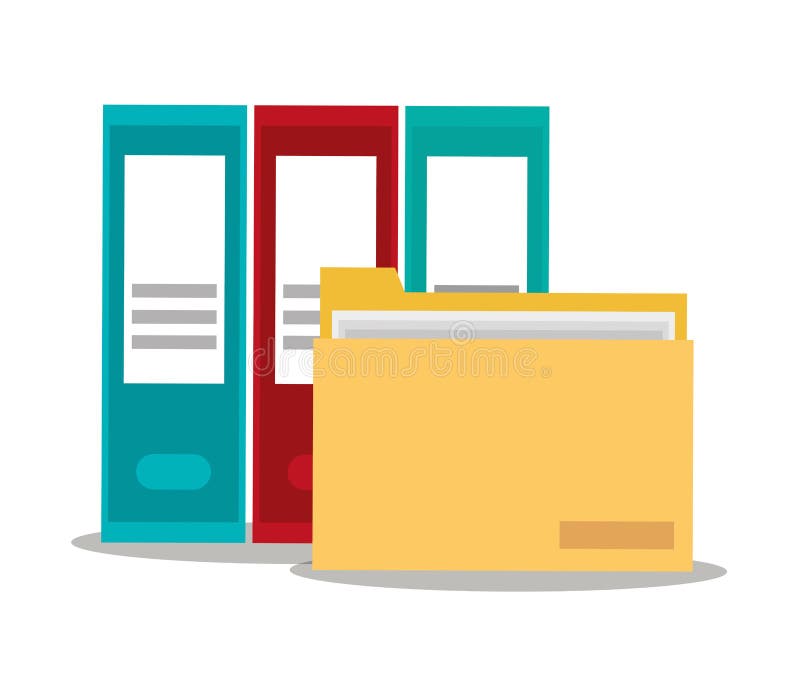
Locate an element on the screen. The image size is (800, 697). white label on left book is located at coordinates (x=196, y=220).